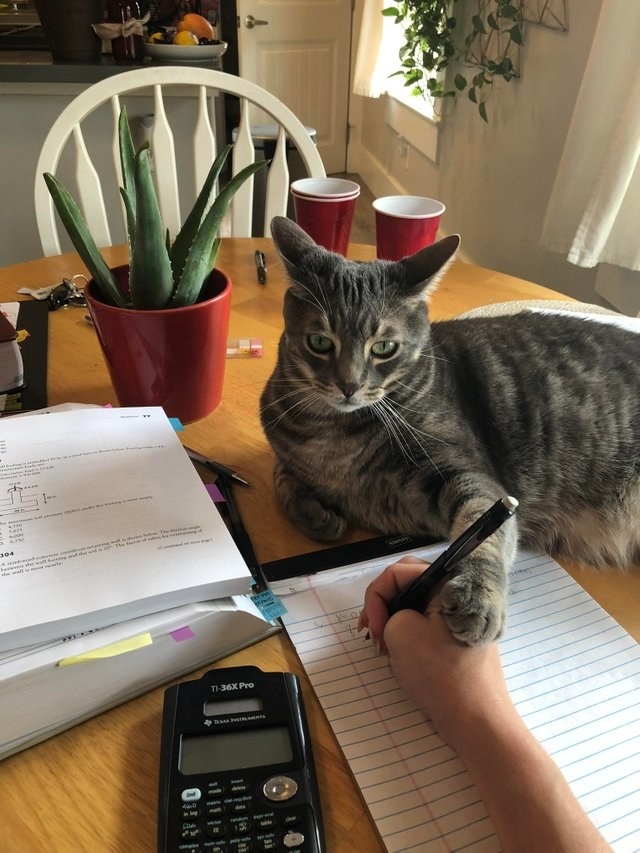
You are a GUI agent. You are given a task and a screenshot of the screen. Output one action in this format:
    pyautogui.click(x=<x>, y=<y>)
    Task: Click on the chair back
    
    Given the screenshot: What is the action you would take?
    pyautogui.click(x=154, y=140)